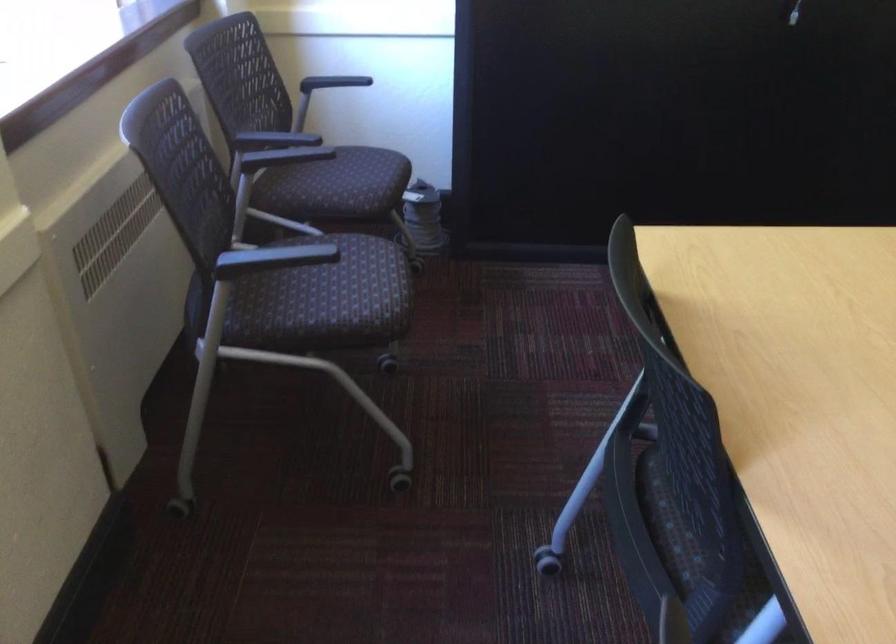
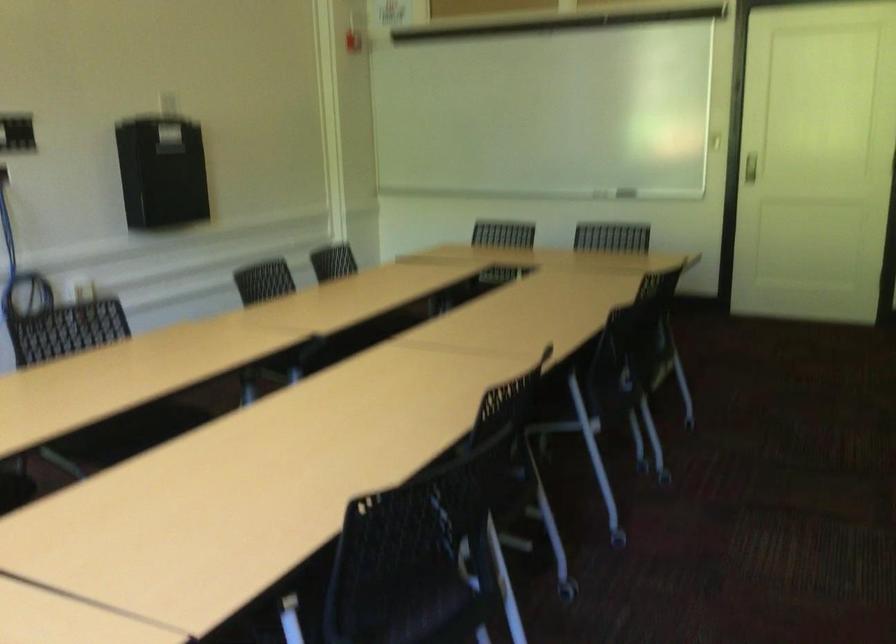
Question: How did the camera likely rotate?

Choices:
 (A) Left
 (B) Right
 (C) Up
 (D) Down

Answer: (B)